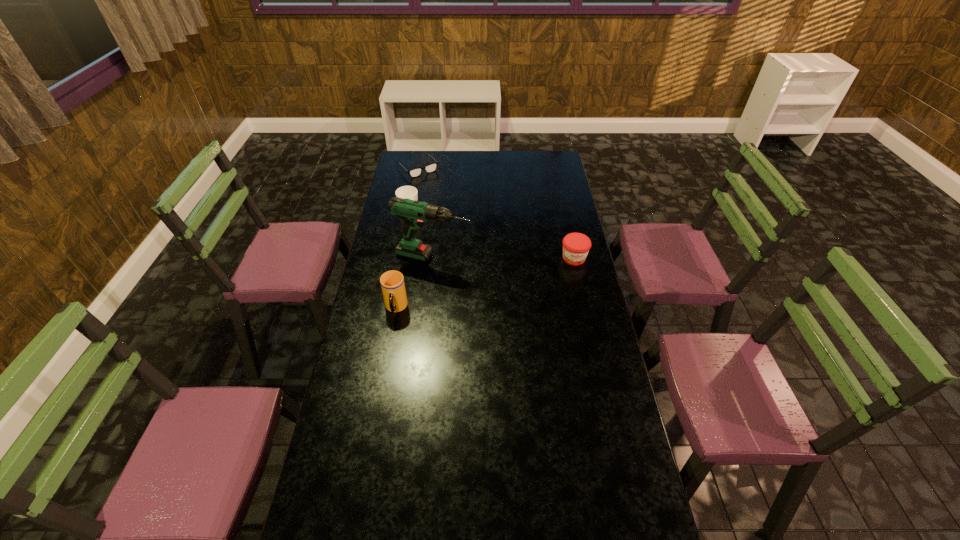
Where is `vacant space located 0.290m with the handle on the side of the farther cup`? vacant space located 0.290m with the handle on the side of the farther cup is located at coordinates (445, 252).

This screenshot has height=540, width=960. I want to click on vacant space situated with the handle on the side of the farther cup, so click(x=456, y=262).

At what (x,y) coordinates should I click in order to perform the action: click on vacant space situated with the handle on the side of the farther cup. Please return your answer as a coordinate pair (x, y). Looking at the image, I should click on (425, 231).

Locate an element on the screen. blank space located 0.290m on the handle side of the drill is located at coordinates (535, 275).

Where is `free location located 0.380m on the handle side of the drill`? This screenshot has width=960, height=540. free location located 0.380m on the handle side of the drill is located at coordinates (557, 280).

You are a GUI agent. You are given a task and a screenshot of the screen. Output one action in this format:
    pyautogui.click(x=<x>, y=<y>)
    Task: Click on the free location located 0.380m on the handle side of the drill
    This screenshot has width=960, height=540.
    Given the screenshot: What is the action you would take?
    pyautogui.click(x=557, y=280)

You are a GUI agent. You are given a task and a screenshot of the screen. Output one action in this format:
    pyautogui.click(x=<x>, y=<y>)
    Task: Click on the vacant space located 0.310m on the front-facing side of the shortest object
    
    Given the screenshot: What is the action you would take?
    pyautogui.click(x=455, y=207)

Identify the location of vacant point located on the front-facing side of the shortest object. (437, 187).

Locate an element on the screen. The width and height of the screenshot is (960, 540). vacant space situated on the front-facing side of the shortest object is located at coordinates (453, 205).

The height and width of the screenshot is (540, 960). Find the location of `object that is at the far edge`. object that is at the far edge is located at coordinates (415, 172).